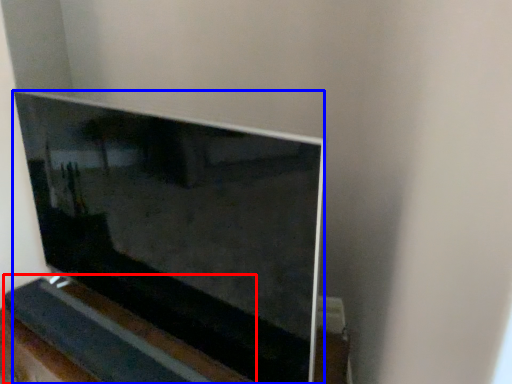
Question: Which point is closer to the camera, ledge (highlighted by a red box) or television (highlighted by a blue box)?

Choices:
 (A) ledge
 (B) television

Answer: (B)